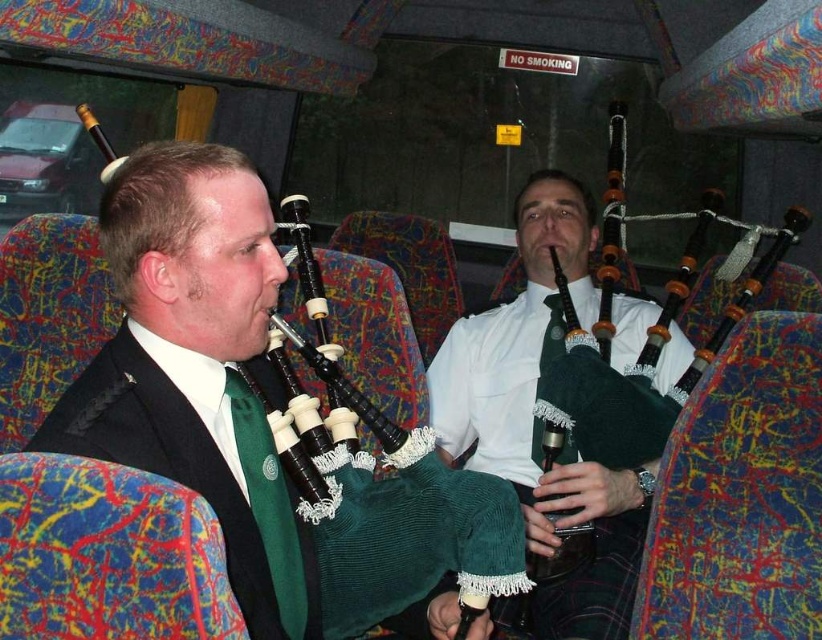
Who is lower down, matte black bagpipes at center or green corduroy kilt at center?

matte black bagpipes at center

Is point (178, 440) farther from viewer compared to point (633, 515)?

That is False.

Locate an element on the screen. matte black bagpipes at center is located at coordinates (225, 394).

Is green corduroy kilt at center taller than green corduroy tie at center?

Yes, green corduroy kilt at center is taller than green corduroy tie at center.

Does green corduroy kilt at center come behind green corduroy tie at center?

Yes, it is.

At what (x,y) coordinates should I click in order to perform the action: click on green corduroy kilt at center. Please return your answer as a coordinate pair (x, y). The image size is (822, 640). Looking at the image, I should click on (532, 419).

Does matte black bagpipes at center have a lesser width compared to green corduroy tie at center?

No, matte black bagpipes at center is not thinner than green corduroy tie at center.

The width and height of the screenshot is (822, 640). What are the coordinates of `matte black bagpipes at center` in the screenshot? It's located at (225, 394).